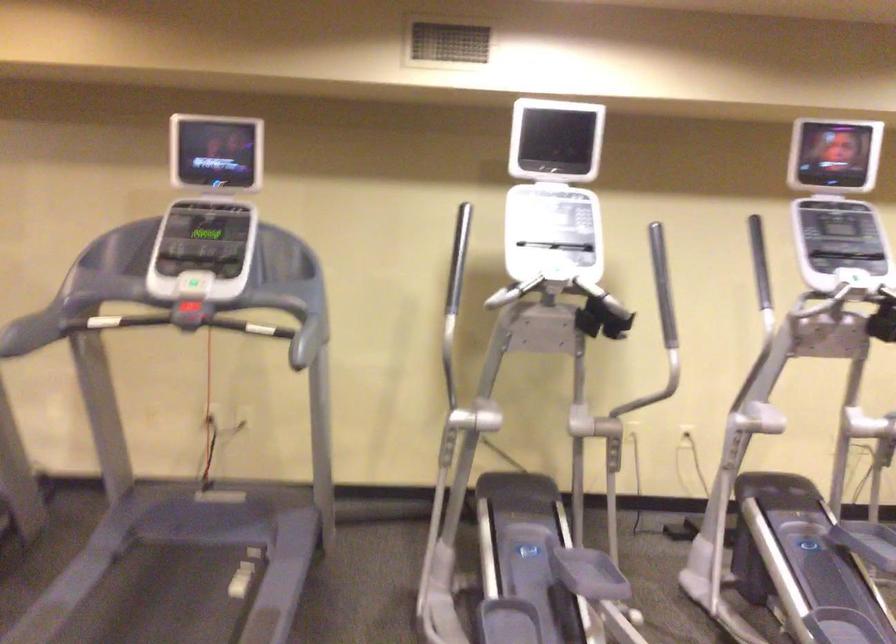
The height and width of the screenshot is (644, 896). What do you see at coordinates (760, 267) in the screenshot?
I see `the black stationary handle` at bounding box center [760, 267].